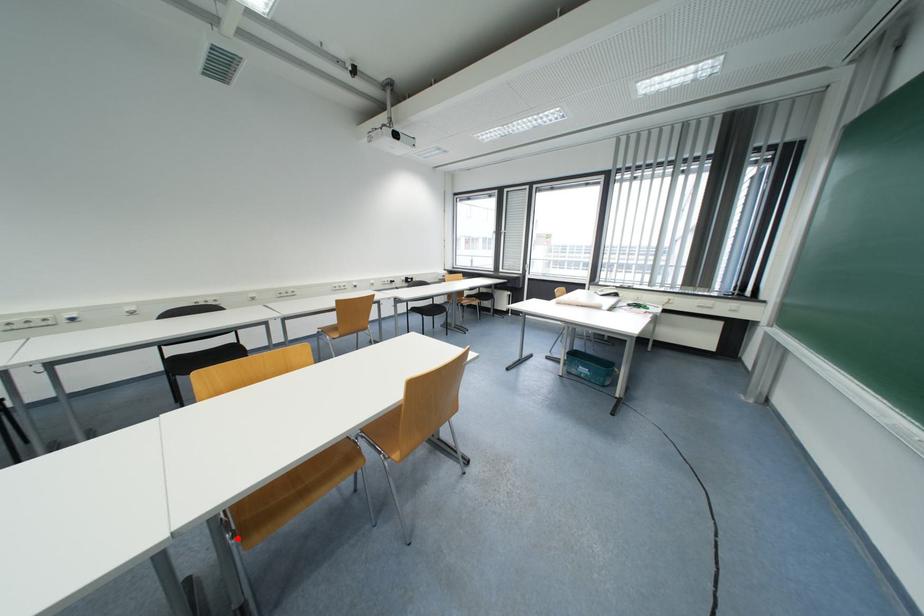
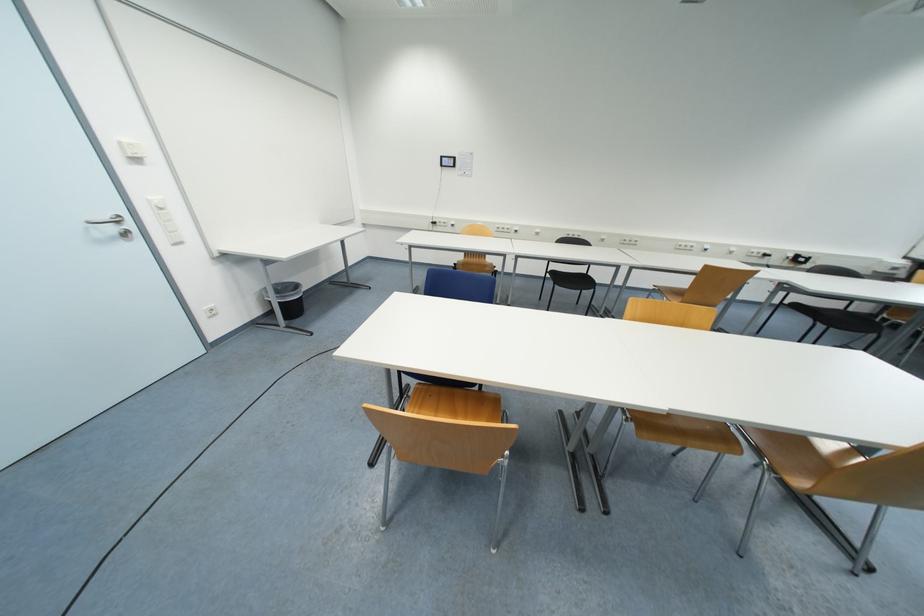
The point at the highlighted location is marked in the first image. Where is the corresponding point in the second image?

(631, 422)